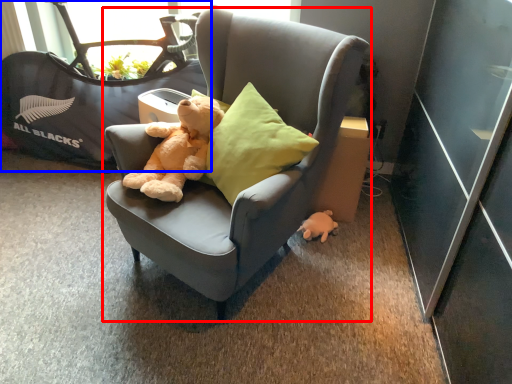
Question: Among these objects, which one is nearest to the camera, chair (highlighted by a red box) or baby carriage (highlighted by a blue box)?

Choices:
 (A) chair
 (B) baby carriage

Answer: (A)